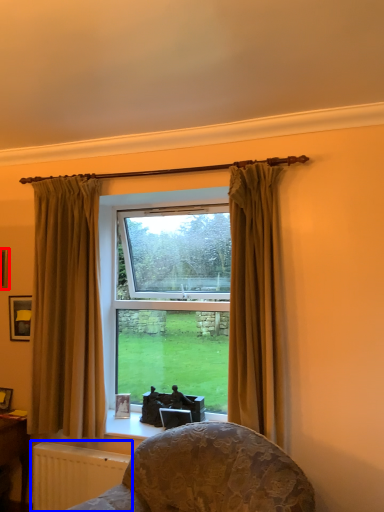
Question: Which object is further to the camera taking this photo, picture frame (highlighted by a red box) or radiator (highlighted by a blue box)?

Choices:
 (A) picture frame
 (B) radiator

Answer: (A)